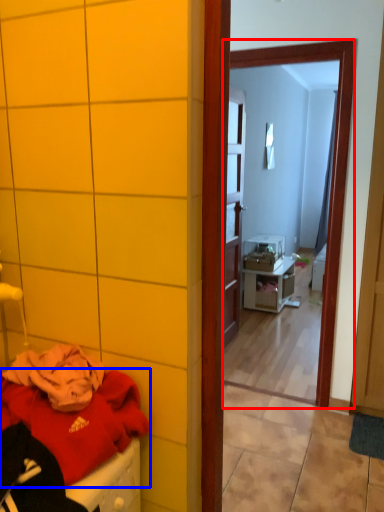
Question: Among these objects, which one is farthest to the camera, mirror (highlighted by a red box) or clothing (highlighted by a blue box)?

Choices:
 (A) mirror
 (B) clothing

Answer: (A)